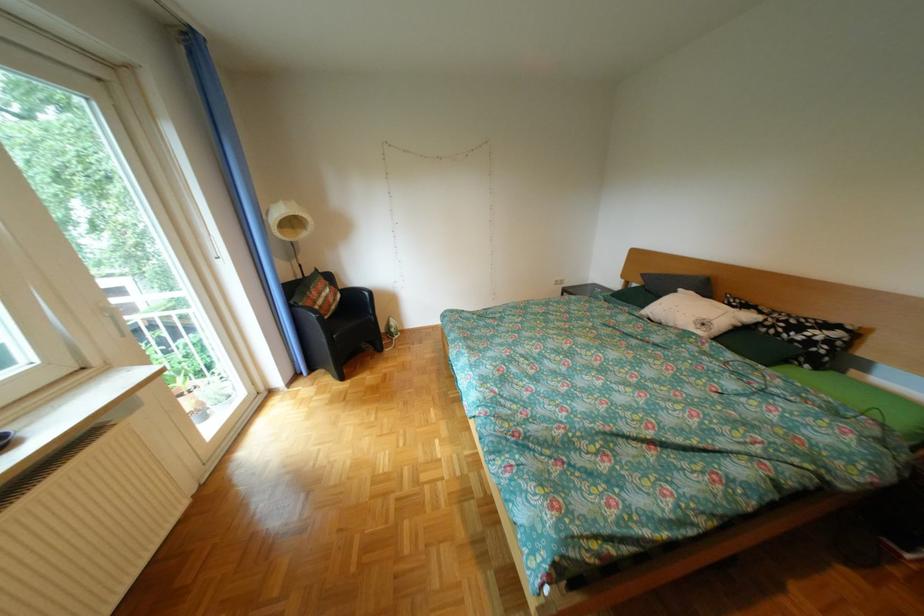
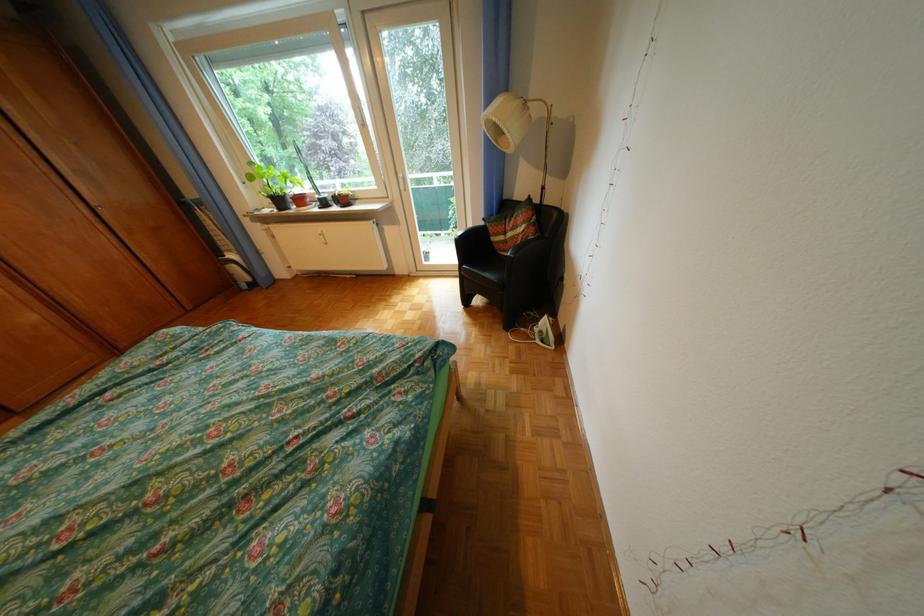
Locate, in the second image, the point that corresponds to point 334,302 in the first image.

(524, 236)